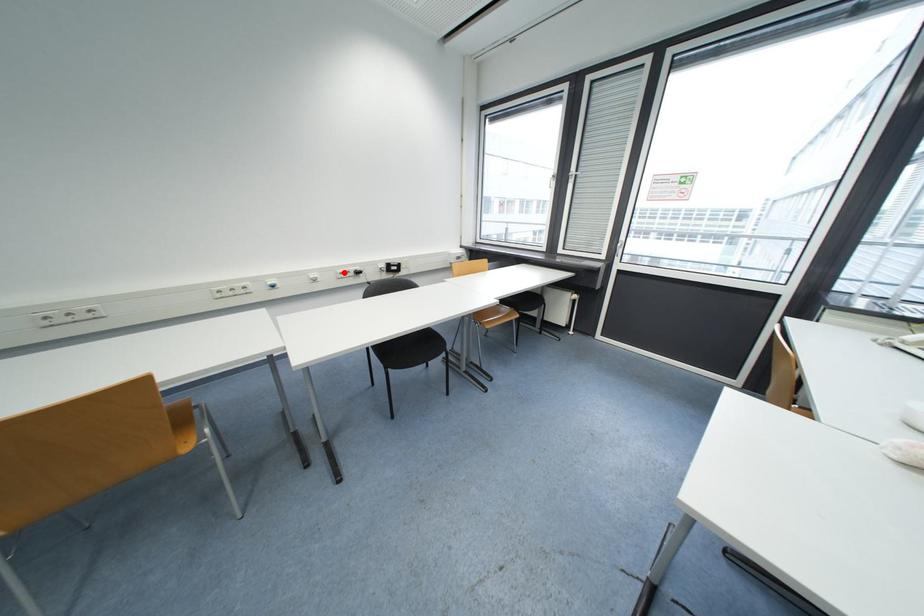
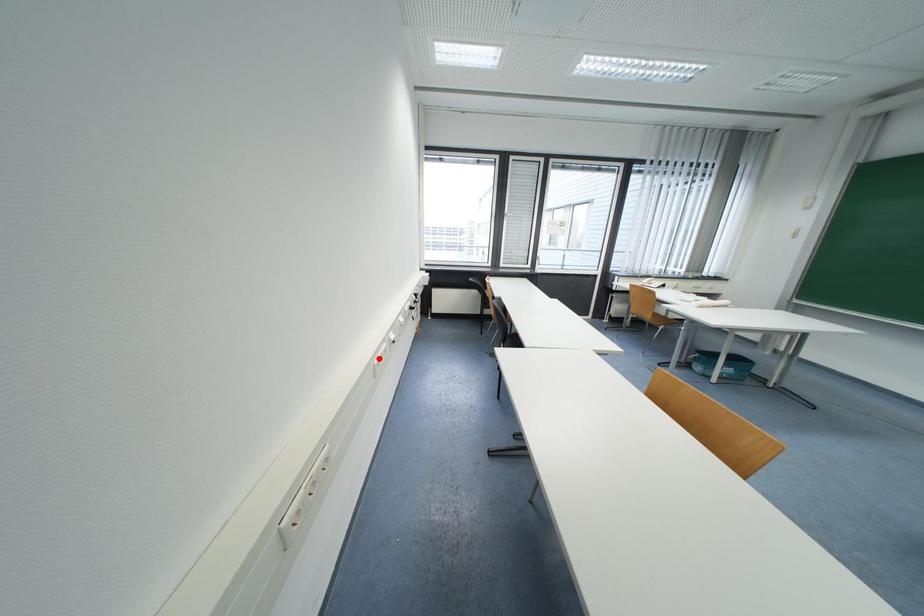
I am providing you with two images of the same scene from different viewpoints. A red point is marked on the first image and another point is marked on the second image. Is the marked point in image1 the same physical position as the marked point in image2?

No